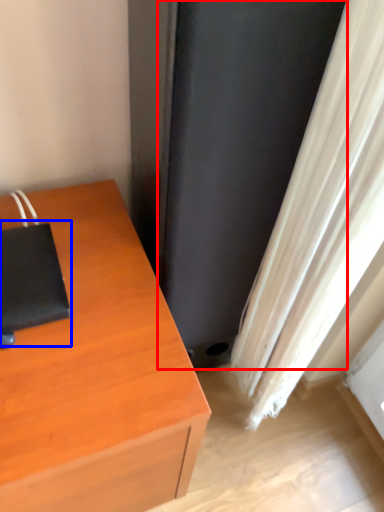
Question: Which object is further to the camera taking this photo, screen door (highlighted by a red box) or notebook (highlighted by a blue box)?

Choices:
 (A) screen door
 (B) notebook

Answer: (B)